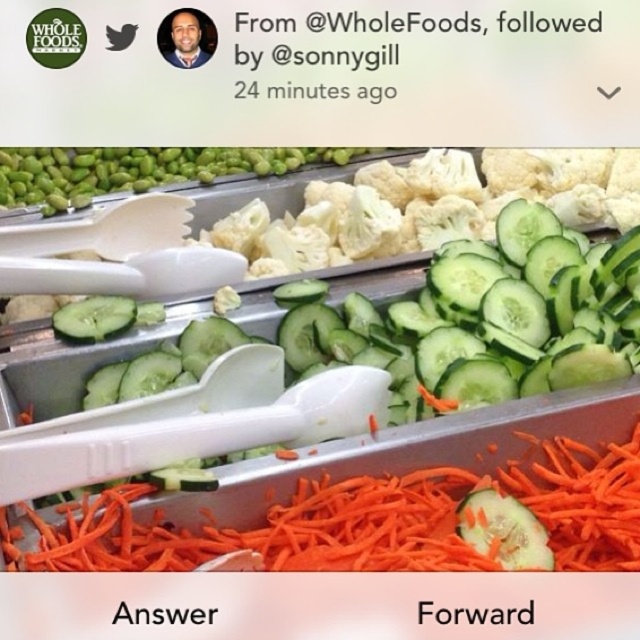
The height and width of the screenshot is (640, 640). What do you see at coordinates (483, 320) in the screenshot? I see `green matte cucumber at center` at bounding box center [483, 320].

Which of these two, green matte cucumber at center or orange shredded carrot at lower center, stands taller?

green matte cucumber at center is taller.

Is point (454, 378) in front of point (154, 560)?

That is False.

Where is `green matte cucumber at center`? green matte cucumber at center is located at coordinates (483, 320).

The image size is (640, 640). Describe the element at coordinates (364, 520) in the screenshot. I see `orange shredded carrot at lower center` at that location.

Does point (628, 518) come closer to viewer compared to point (45, 172)?

Yes, it is in front of point (45, 172).

Which is behind, point (125, 540) or point (12, 157)?

The point (12, 157) is behind.

At what (x,y) coordinates should I click in order to perform the action: click on orange shredded carrot at lower center. Please return your answer as a coordinate pair (x, y). Image resolution: width=640 pixels, height=640 pixels. Looking at the image, I should click on (364, 520).

Is the position of green matte cucumber at center less distant than that of green matte edamame at upper left?

Yes, it is.

Does point (561, 346) come in front of point (77, 192)?

Yes, it is.

Does point (392, 372) come in front of point (232, 157)?

Yes.

Image resolution: width=640 pixels, height=640 pixels. Find the location of `green matte cucumber at center`. green matte cucumber at center is located at coordinates (483, 320).